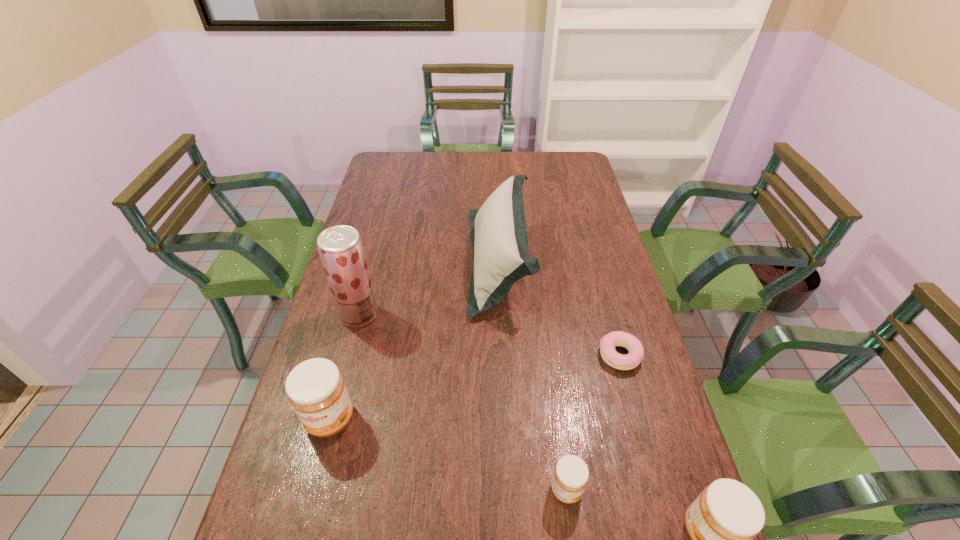
Locate an element on the screen. The height and width of the screenshot is (540, 960). vacant space located 0.220m on the surface of the cushion is located at coordinates (403, 262).

Find the location of a particular element. This screenshot has height=540, width=960. vacant space located on the surface of the cushion is located at coordinates (374, 262).

In order to click on vacant region located on the surface of the cushion in this screenshot , I will do [x=350, y=262].

At what (x,y) coordinates should I click in order to perform the action: click on free spot located on the right of the tallest object. Please return your answer as a coordinate pair (x, y). This screenshot has height=540, width=960. Looking at the image, I should click on (415, 315).

You are a GUI agent. You are given a task and a screenshot of the screen. Output one action in this format:
    pyautogui.click(x=<x>, y=<y>)
    Task: Click on the vacant space situated 0.380m on the back of the shortest object
    Image resolution: width=960 pixels, height=540 pixels.
    Given the screenshot: What is the action you would take?
    pyautogui.click(x=591, y=252)

Find the location of a particular element. The width and height of the screenshot is (960, 540). object present at the near edge is located at coordinates (570, 477).

The width and height of the screenshot is (960, 540). I want to click on jam positioned at the left edge, so click(316, 390).

I want to click on fruit juice that is positioned at the left edge, so click(340, 247).

Where is `object that is positioned at the right edge`? object that is positioned at the right edge is located at coordinates (608, 343).

This screenshot has height=540, width=960. I want to click on vacant region at the far edge of the desktop, so click(474, 169).